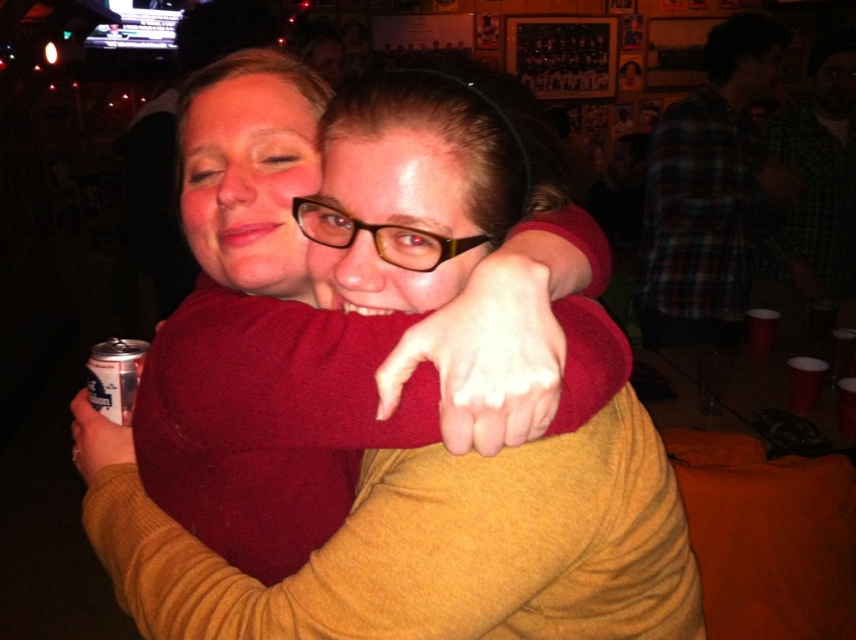
You are a photographer adjusting your camera settings to capture the scene. You need to ensure that both the matte red sweater at center and the silver metallic can at lower left are in focus. Given their sizes, which object might require more careful adjustment to avoid blurring?

The silver metallic can at lower left might require more careful adjustment since it is smaller in width compared to the matte red sweater at center, making it easier to blur if not properly focused.

You are a photographer trying to capture the perfect shot of the matte red sweater at center in the image. The camera you are using has a focus point at coordinates point (x=431, y=545). Will this focus point be effective for capturing the matte red sweater at center?

Yes, the focus point at point (x=431, y=545) is effective because it directly marks the location of the matte red sweater at center.

You are at a social event and want to grab the silver metallic can at lower left from the matte red sweater at center. Can you reach it without moving the sweater?

The matte red sweater at center is closer to the viewer than the silver metallic can at lower left, so you can reach the silver metallic can at lower left by extending your arm past the sweater.